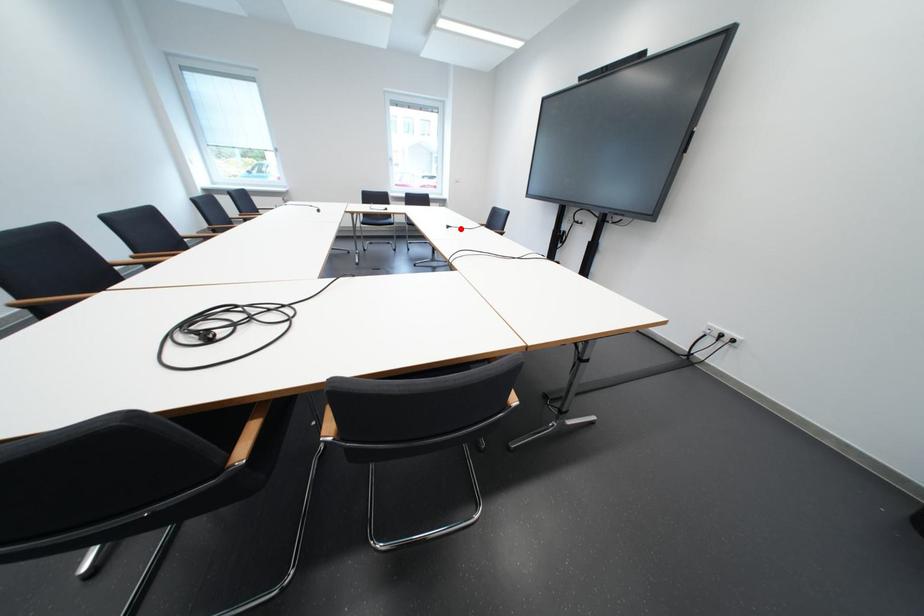
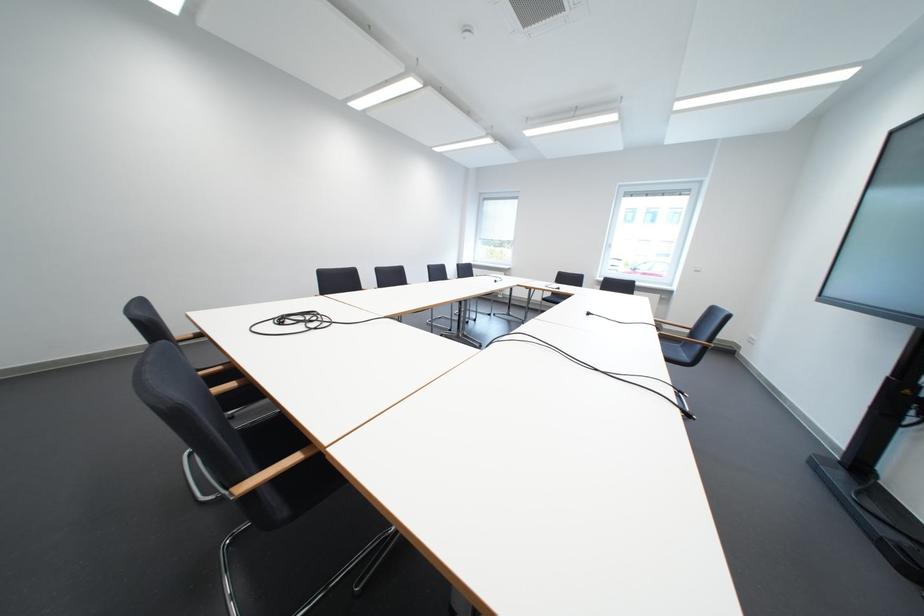
Question: I am providing you with two images of the same scene from different viewpoints. A red point is shown in image1. For the corresponding object point in image2, is it positioned nearer or farther from the camera?

Choices:
 (A) Nearer
 (B) Farther

Answer: (A)